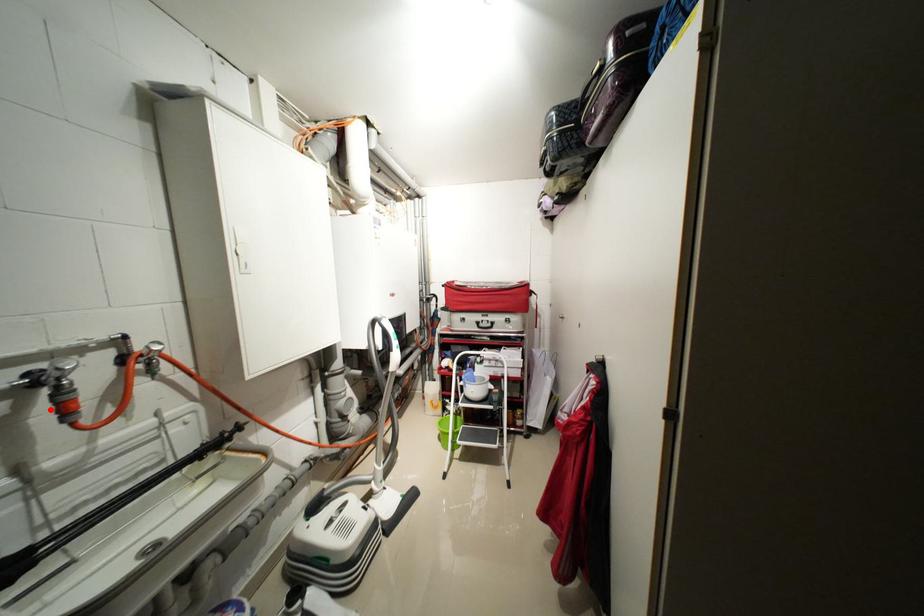
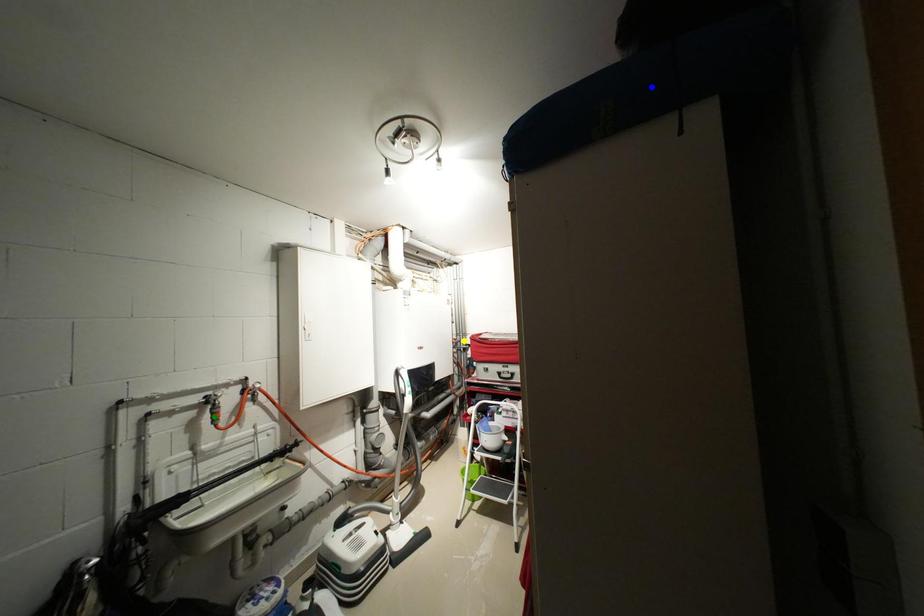
Question: I am providing you with two images of the same scene from different viewpoints. A red point is marked on the first image. You are given multiple points on the second image. Which point in image 2 represents the same 3d spot as the red point in image 1?

Choices:
 (A) blue point
 (B) green point
 (C) yellow point

Answer: (B)